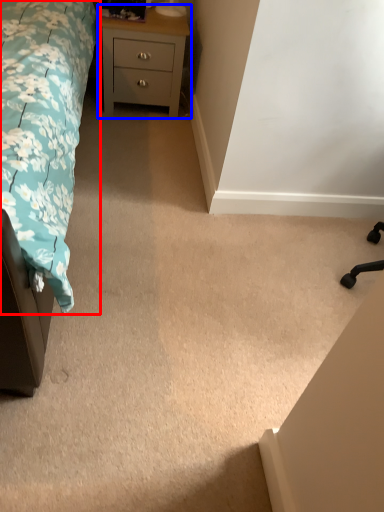
Question: Which of the following is the farthest to the observer, bed (highlighted by a red box) or chest of drawers (highlighted by a blue box)?

Choices:
 (A) bed
 (B) chest of drawers

Answer: (B)